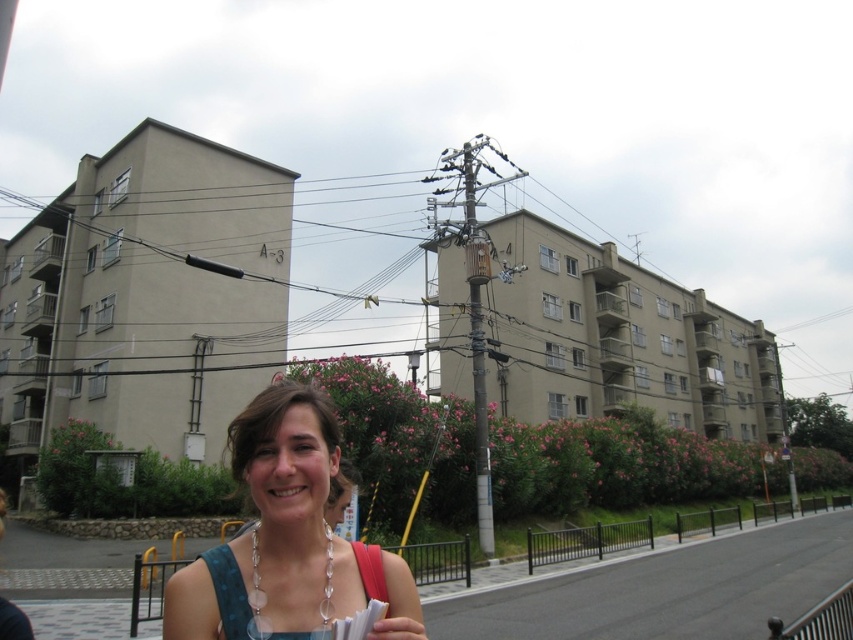
Question: Does matte blue dress at center appear under smooth skin hand at lower center?

Choices:
 (A) yes
 (B) no

Answer: (B)

Question: Which point is closer to the camera?

Choices:
 (A) smooth skin hand at lower center
 (B) matte blue dress at center

Answer: (A)

Question: Can you confirm if matte blue dress at center is positioned to the left of smooth skin hand at lower center?

Choices:
 (A) no
 (B) yes

Answer: (B)

Question: Which point is farther to the camera?

Choices:
 (A) smooth skin hand at lower center
 (B) matte blue dress at center

Answer: (B)

Question: Is matte blue dress at center wider than smooth skin hand at lower center?

Choices:
 (A) no
 (B) yes

Answer: (B)